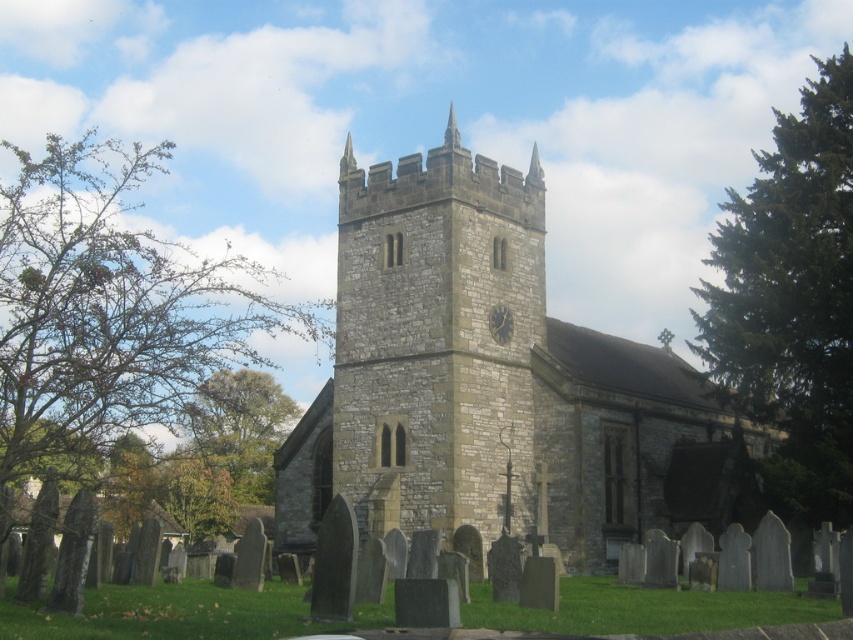
Question: Is stone church at center further to the viewer compared to metallic gray clock at center?

Choices:
 (A) yes
 (B) no

Answer: (B)

Question: Can you confirm if stone church at center is positioned below metallic gray clock at center?

Choices:
 (A) yes
 (B) no

Answer: (A)

Question: Which object is positioned closest to the stone clock tower at center?

Choices:
 (A) stone church at center
 (B) metallic gray clock at center

Answer: (A)

Question: Which point is farther from the camera taking this photo?

Choices:
 (A) (512, 328)
 (B) (497, 404)
 (C) (515, 225)

Answer: (C)

Question: Does stone clock tower at center appear under metallic gray clock at center?

Choices:
 (A) no
 (B) yes

Answer: (B)

Question: Based on their relative distances, which object is nearer to the metallic gray clock at center?

Choices:
 (A) stone church at center
 (B) stone clock tower at center

Answer: (B)